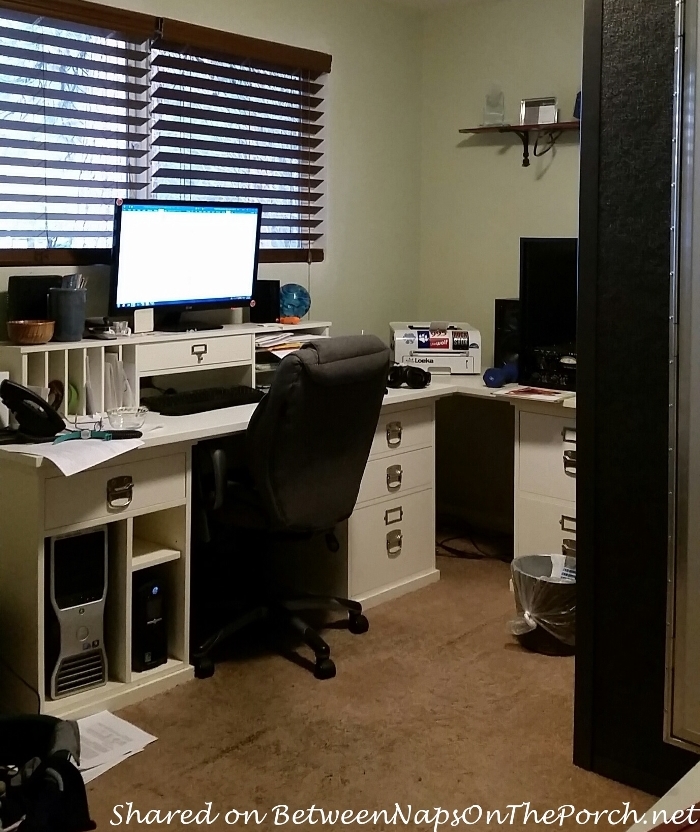
This screenshot has height=832, width=700. I want to click on chair, so click(x=337, y=389).